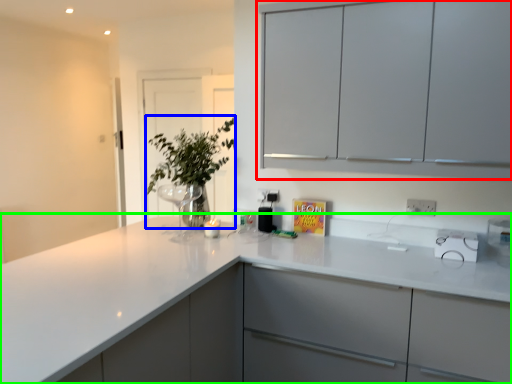
Question: Estimate the real-world distances between objects in this image. Which object is closer to cabinetry (highlighted by a red box), plant (highlighted by a blue box) or countertop (highlighted by a green box)?

Choices:
 (A) plant
 (B) countertop

Answer: (B)